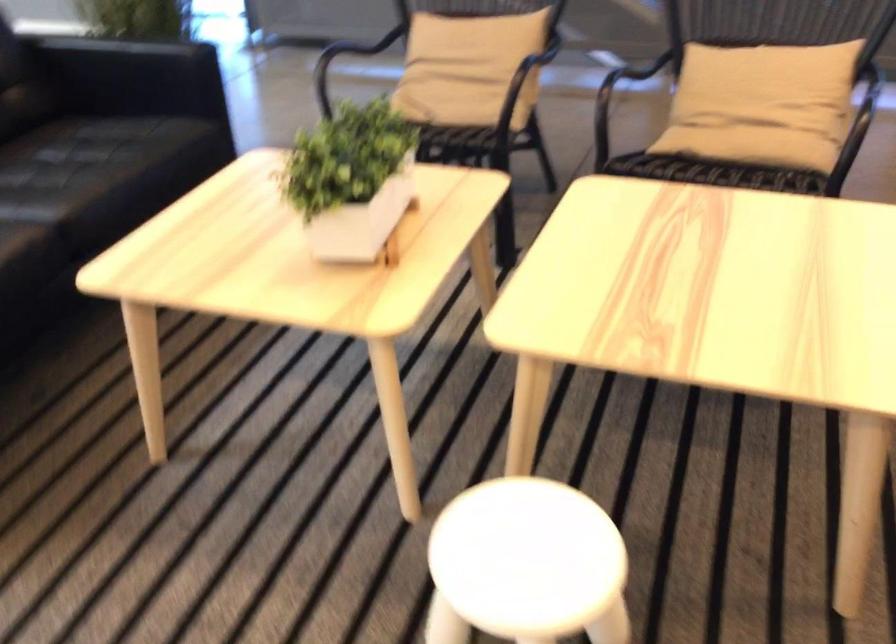
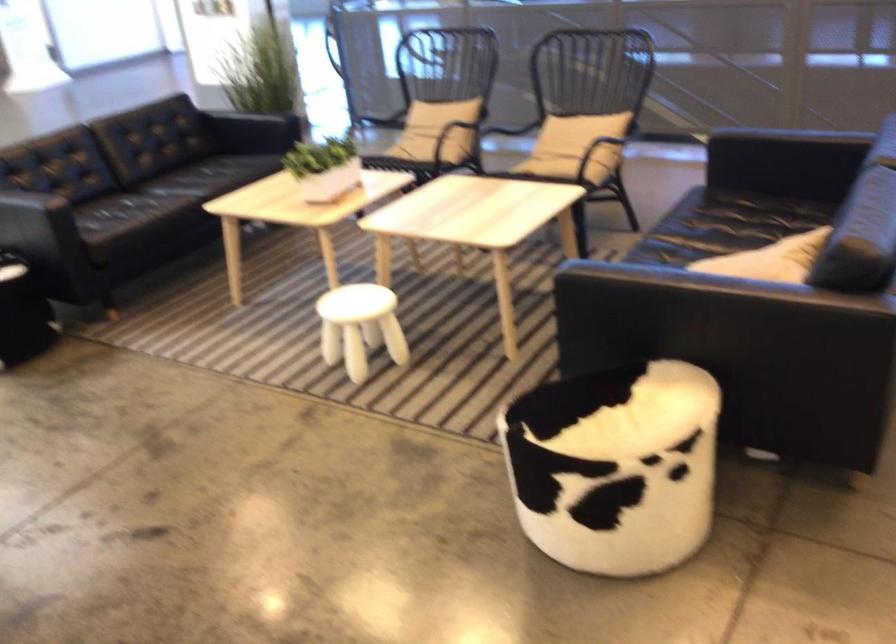
In the second image, find the point that corresponds to pixel 539 91 in the first image.

(450, 135)